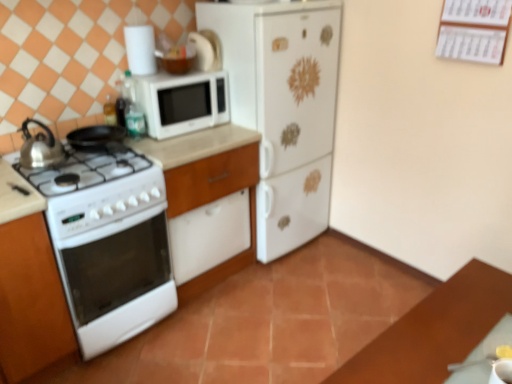
Question: Can you confirm if white glossy dishwasher at center is bigger than white matte refrigerator at center?

Choices:
 (A) no
 (B) yes

Answer: (A)

Question: Is white glossy dishwasher at center directly adjacent to white matte refrigerator at center?

Choices:
 (A) yes
 (B) no

Answer: (B)

Question: From a real-world perspective, is white glossy dishwasher at center physically above white matte refrigerator at center?

Choices:
 (A) no
 (B) yes

Answer: (A)

Question: Is white glossy dishwasher at center looking in the opposite direction of white matte refrigerator at center?

Choices:
 (A) yes
 (B) no

Answer: (B)

Question: From a real-world perspective, is white glossy dishwasher at center below white matte refrigerator at center?

Choices:
 (A) no
 (B) yes

Answer: (B)

Question: Considering the positions of point (446, 44) and point (57, 155), is point (446, 44) closer or farther from the camera than point (57, 155)?

Choices:
 (A) closer
 (B) farther

Answer: (B)

Question: From a real-world perspective, is white paper calendar at upper right physically located above or below shiny metallic kettle at left?

Choices:
 (A) above
 (B) below

Answer: (A)

Question: Visually, is white paper calendar at upper right positioned to the left or to the right of shiny metallic kettle at left?

Choices:
 (A) right
 (B) left

Answer: (A)

Question: Is white paper calendar at upper right wider or thinner than shiny metallic kettle at left?

Choices:
 (A) wide
 (B) thin

Answer: (B)

Question: Does point (x=292, y=228) appear closer or farther from the camera than point (x=233, y=165)?

Choices:
 (A) farther
 (B) closer

Answer: (A)

Question: Looking at their shapes, would you say white matte refrigerator at center is wider or thinner than white glossy dishwasher at center?

Choices:
 (A) thin
 (B) wide

Answer: (B)

Question: Is white matte refrigerator at center to the left or to the right of white glossy dishwasher at center in the image?

Choices:
 (A) right
 (B) left

Answer: (A)

Question: In the image, is white matte refrigerator at center positioned in front of or behind white glossy dishwasher at center?

Choices:
 (A) front
 (B) behind

Answer: (B)

Question: Visually, is white matte refrigerator at center positioned to the left or to the right of white glossy countertop at lower left?

Choices:
 (A) left
 (B) right

Answer: (B)

Question: Is point (289, 61) closer or farther from the camera than point (183, 173)?

Choices:
 (A) closer
 (B) farther

Answer: (B)